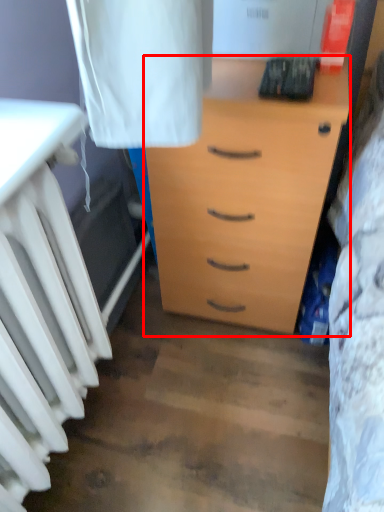
Question: From the image's perspective, what is the correct spatial positioning of chest of drawers (annotated by the red box) in reference to radiator?

Choices:
 (A) below
 (B) above

Answer: (B)